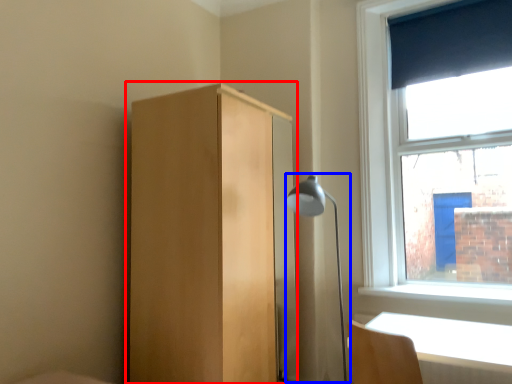
Question: Among these objects, which one is farthest to the camera, dresser (highlighted by a red box) or lamp (highlighted by a blue box)?

Choices:
 (A) dresser
 (B) lamp

Answer: (B)